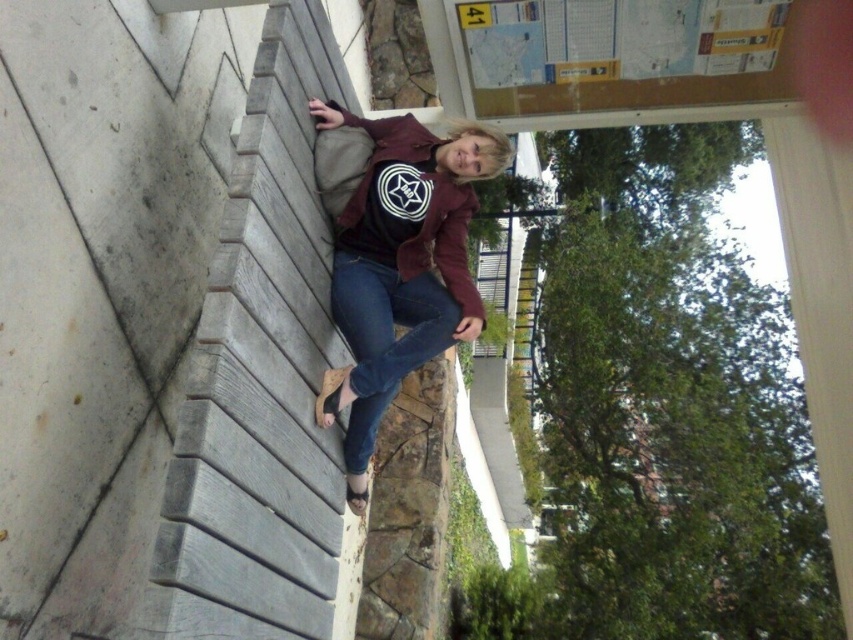
Is wooden corkboard at upper right to the right of matte maroon sweatshirt at center from the viewer's perspective?

Indeed, wooden corkboard at upper right is positioned on the right side of matte maroon sweatshirt at center.

Measure the distance from wooden corkboard at upper right to matte maroon sweatshirt at center.

They are 26.36 inches apart.

Which is in front, point (564, 33) or point (466, 310)?

Point (466, 310) is in front.

Image resolution: width=853 pixels, height=640 pixels. I want to click on wooden corkboard at upper right, so click(622, 56).

Which is behind, point (341, 404) or point (450, 330)?

Positioned behind is point (450, 330).

Is matte brown jacket at center thinner than denim at left?

Incorrect, matte brown jacket at center's width is not less than denim at left's.

Where is `matte brown jacket at center`? matte brown jacket at center is located at coordinates (399, 266).

Is wooden corkboard at upper right to the right of denim at left from the viewer's perspective?

Indeed, wooden corkboard at upper right is positioned on the right side of denim at left.

Is point (569, 106) positioned in front of point (426, 305)?

No, (569, 106) is behind (426, 305).

Which is in front, point (605, 13) or point (410, 282)?

Point (605, 13)

Where is `wooden corkboard at upper right`? This screenshot has width=853, height=640. wooden corkboard at upper right is located at coordinates (622, 56).